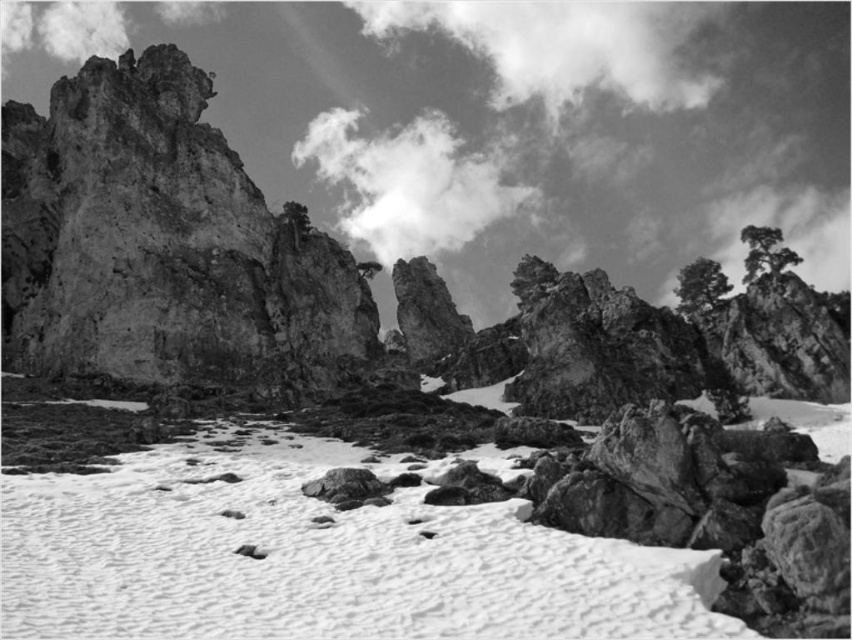
Looking at the mountain landscape, where is the white textured snow at center in relation to the cloudy sky at upper center?

The white textured snow at center is located to the right of the cloudy sky at upper center.

You are a mountain climber looking at this landscape. You notice the white textured snow at center and the fuzzy white cloud at upper center. Which object is higher in the scene?

The fuzzy white cloud at upper center is higher than the white textured snow at center.

You are a hiker trying to navigate through the mountainous terrain shown in the image. You see a point marked at coordinates (565, 45). Based on the scene description, what is the elevation of this point compared to the surrounding area?

The point at (565, 45) is on a fuzzy white cloud at upper center, so it is likely at a higher elevation than the surrounding rocky terrain below.